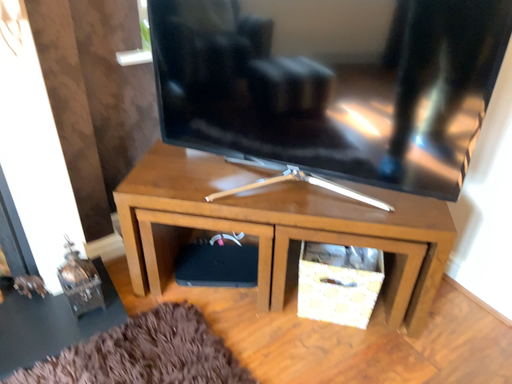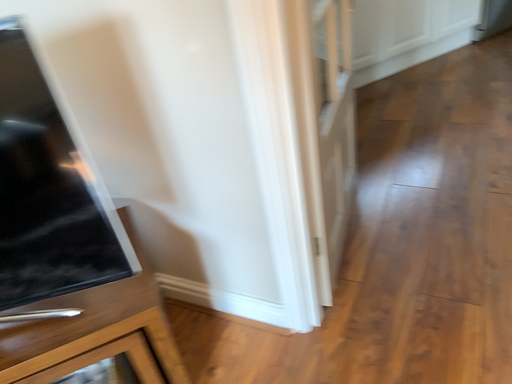
Question: Which way did the camera rotate in the video?

Choices:
 (A) rotated upward
 (B) rotated downward

Answer: (A)